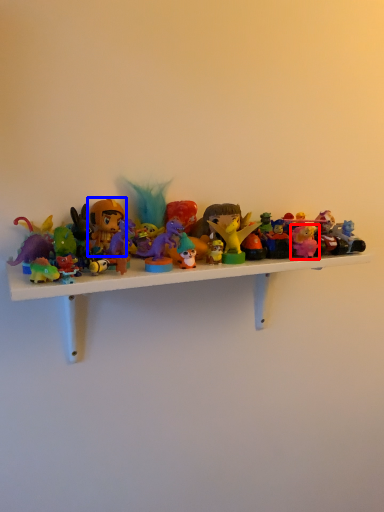
Question: Which of the following is the farthest to the observer, toy (highlighted by a red box) or toy (highlighted by a blue box)?

Choices:
 (A) toy
 (B) toy

Answer: (A)